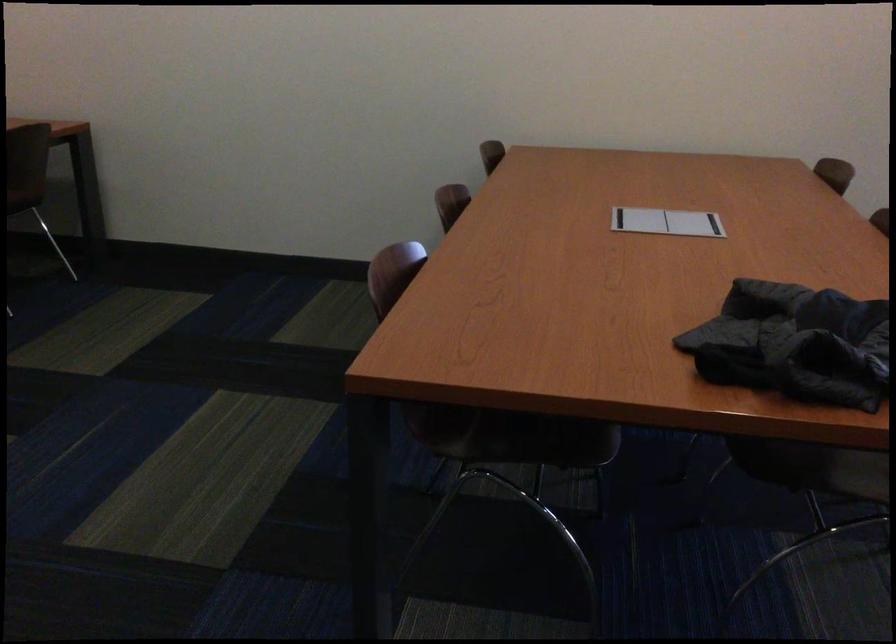
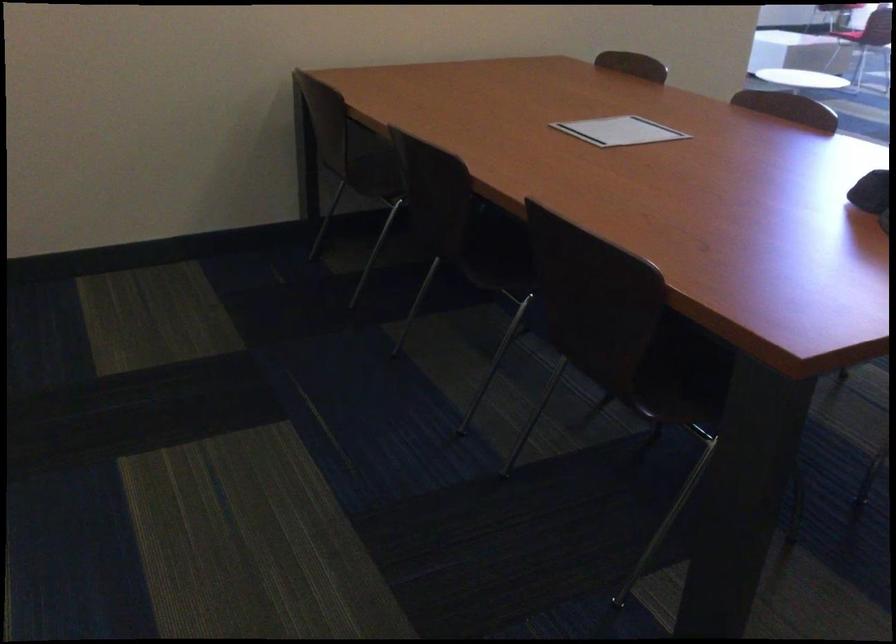
The point at (511, 428) is marked in the first image. Where is the corresponding point in the second image?

(684, 375)